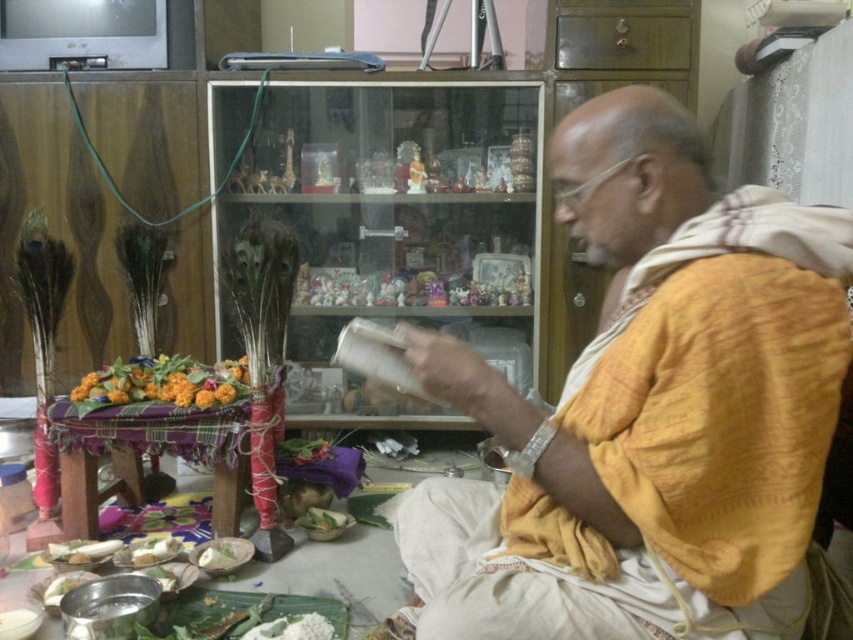
Question: Can you confirm if yellow cotton cloth at center is thinner than white matte plate at lower left?

Choices:
 (A) no
 (B) yes

Answer: (A)

Question: Is yellow cotton cloth at center to the left of floral bouquet at center from the viewer's perspective?

Choices:
 (A) yes
 (B) no

Answer: (B)

Question: Can you confirm if yellow cotton cloth at center is wider than white matte rice at lower center?

Choices:
 (A) no
 (B) yes

Answer: (B)

Question: Which of the following is the closest to the observer?

Choices:
 (A) white matte rice at lower center
 (B) white matte plate at lower left

Answer: (A)

Question: Based on their relative distances, which object is nearer to the yellow cotton cloth at center?

Choices:
 (A) white matte rice at lower center
 (B) floral bouquet at center
 (C) white matte plate at lower left

Answer: (B)

Question: Estimate the real-world distances between objects in this image. Which object is closer to the yellow cotton cloth at center?

Choices:
 (A) white matte rice at lower center
 (B) white matte plate at lower left
 (C) floral bouquet at center

Answer: (C)